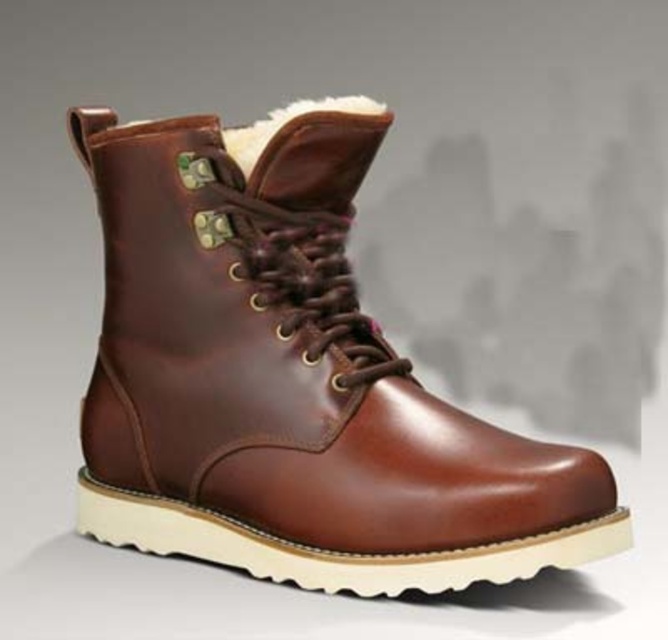
In the scene shown: You are a fashion designer examining the brown leather boot at center and the white fluffy fur at upper center. Which part of the boot is closer to you?

The brown leather boot at center is closer to the viewer than the white fluffy fur at upper center.

You are a designer trying to place a new accessory on the image. The accessory must be placed at the exact coordinates of point (291, 385). Based on the scene description, what object is located at this point?

The point (291, 385) marks the location of the brown leather boot at center.